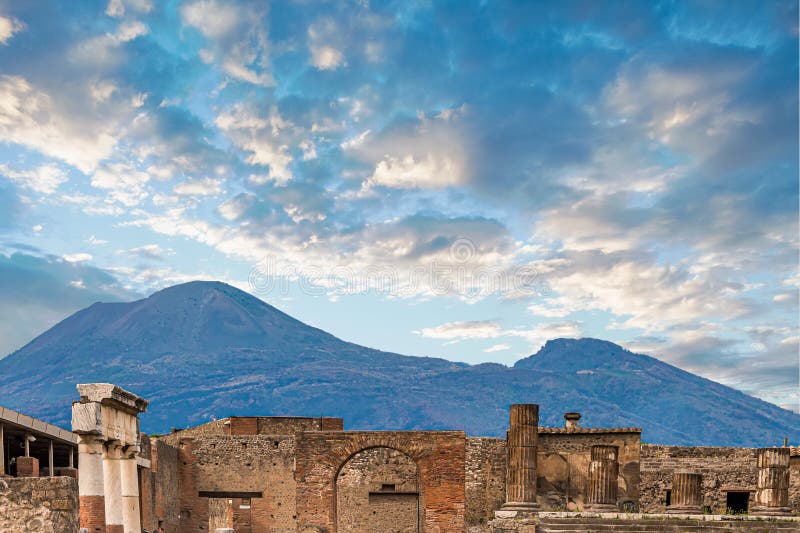
This screenshot has height=533, width=800. I want to click on pillar, so click(x=110, y=492).